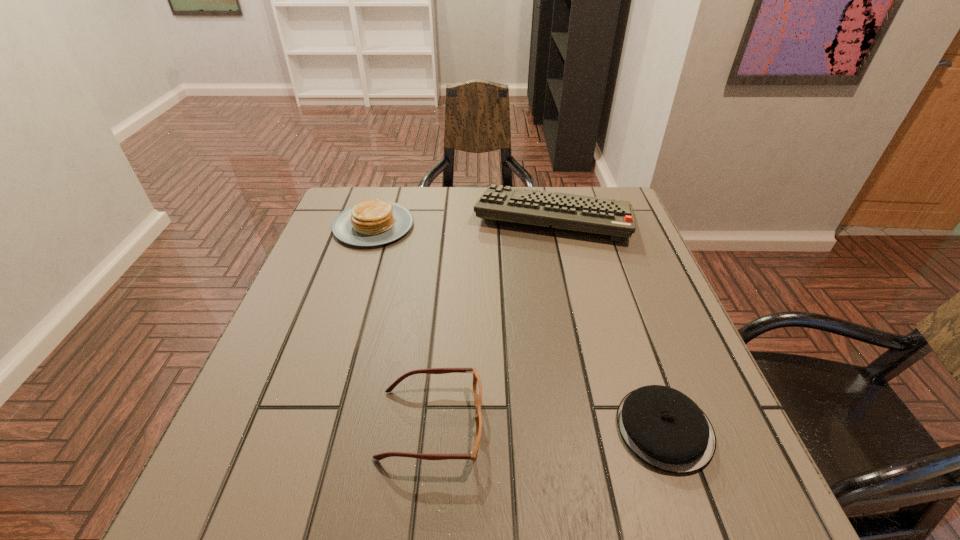
I want to click on blank region between the leftmost object and the right pancake, so click(x=519, y=327).

This screenshot has width=960, height=540. I want to click on empty location between the computer keyboard and the spectacles, so click(x=492, y=320).

Find the location of `empty space that is in between the computer keyboard and the right pancake`. empty space that is in between the computer keyboard and the right pancake is located at coordinates (609, 322).

The image size is (960, 540). Find the location of `blank region between the spectacles and the computer keyboard`. blank region between the spectacles and the computer keyboard is located at coordinates tap(492, 320).

In order to click on free space that is in between the leftmost object and the computer keyboard in this screenshot , I will do click(x=464, y=221).

Where is `free point between the computer keyboard and the nearer pancake`? Image resolution: width=960 pixels, height=540 pixels. free point between the computer keyboard and the nearer pancake is located at coordinates (609, 322).

Find the location of a particular element. The height and width of the screenshot is (540, 960). vacant space that's between the right pancake and the farther pancake is located at coordinates (519, 327).

I want to click on free space that is in between the nearer pancake and the computer keyboard, so click(x=609, y=322).

Choose which object is the second nearest neighbor to the nearer pancake. Please provide its 2D coordinates. Your answer should be formatted as a tuple, i.e. [(x, y)], where the tuple contains the x and y coordinates of a point satisfying the conditions above.

[(582, 213)]

Locate which object is the closest to the spectacles. Please provide its 2D coordinates. Your answer should be formatted as a tuple, i.e. [(x, y)], where the tuple contains the x and y coordinates of a point satisfying the conditions above.

[(663, 427)]